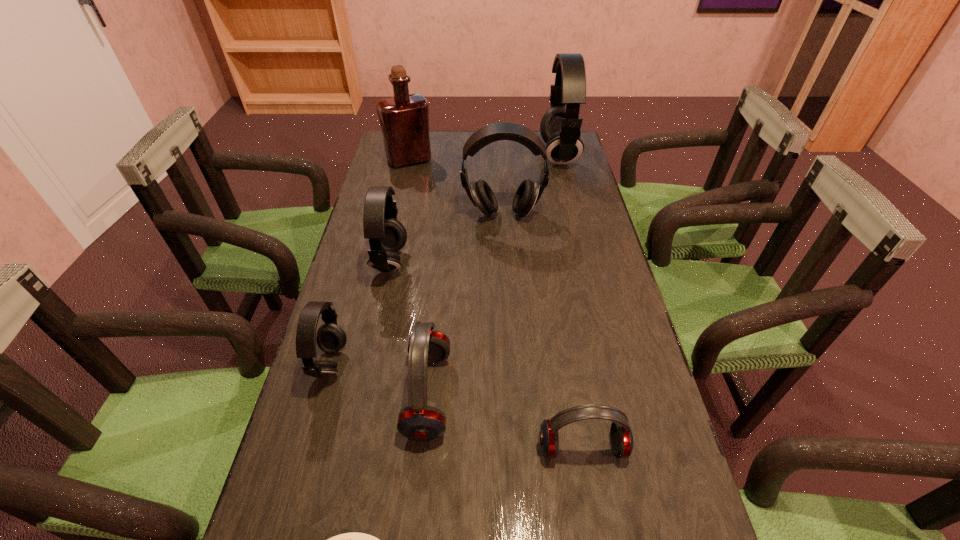
Identify which black earphone is the third nearest to the nearest object. Please provide its 2D coordinates. Your answer should be formatted as a tuple, i.e. [(x, y)], where the tuple contains the x and y coordinates of a point satisfying the conditions above.

[(528, 193)]

The height and width of the screenshot is (540, 960). I want to click on black earphone that is the third closest one to the left red earphone, so click(528, 193).

This screenshot has height=540, width=960. What are the coordinates of `free space that satisfies the following two spatial constraints: 1. on the ear cups of the farthest earphone; 2. on the ear cups of the fifth nearest earphone` in the screenshot? It's located at (573, 214).

Find the location of `free spot that satisfies the following two spatial constraints: 1. on the ear cups of the second black earphone from right to left; 2. on the ear cups of the smallest black earphone`. free spot that satisfies the following two spatial constraints: 1. on the ear cups of the second black earphone from right to left; 2. on the ear cups of the smallest black earphone is located at coordinates (512, 364).